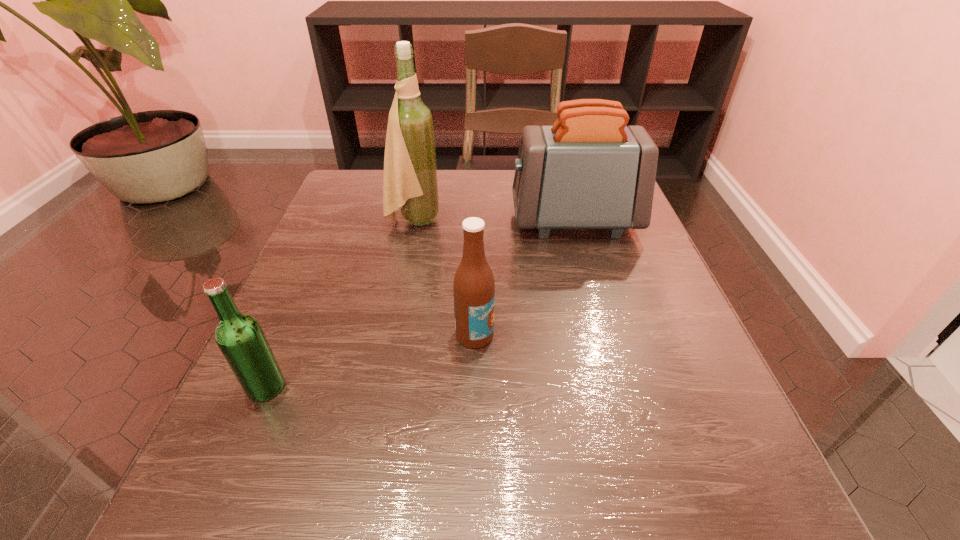
Where is `blank space located 0.330m on the front-facing side of the toaster`? blank space located 0.330m on the front-facing side of the toaster is located at coordinates pos(364,221).

Where is `free space located on the left of the second nearest object`? This screenshot has height=540, width=960. free space located on the left of the second nearest object is located at coordinates (305, 334).

Find the location of a particular element. vacant space located 0.370m on the back of the nearest object is located at coordinates (333, 232).

Image resolution: width=960 pixels, height=540 pixels. In order to click on wine bottle that is positioned at the far edge in this screenshot , I will do `click(410, 183)`.

Locate an element on the screen. The width and height of the screenshot is (960, 540). toaster that is at the far edge is located at coordinates (589, 170).

Find the location of a particular element. This screenshot has height=540, width=960. wine bottle positioned at the left edge is located at coordinates (410, 183).

Identify the location of beer bottle located at the left edge. (239, 336).

You are a GUI agent. You are given a task and a screenshot of the screen. Output one action in this format:
    pyautogui.click(x=<x>, y=<y>)
    Task: Click on the object that is at the right edge
    The image size is (960, 540).
    Given the screenshot: What is the action you would take?
    tap(589, 170)

This screenshot has width=960, height=540. In order to click on object at the far left corner in this screenshot , I will do `click(410, 183)`.

This screenshot has height=540, width=960. Find the location of `object present at the far right corner`. object present at the far right corner is located at coordinates (589, 170).